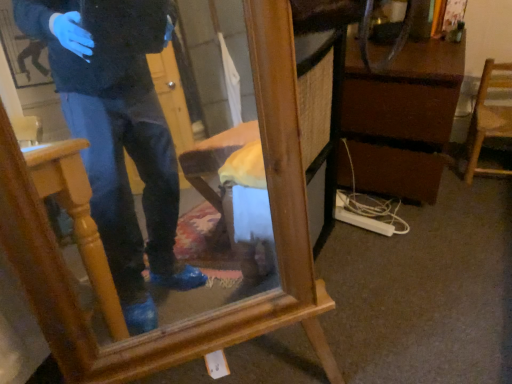
Image resolution: width=512 pixels, height=384 pixels. Identify the location of free space that is in between wooden chair at right and brown wood vanity at center right. (463, 183).